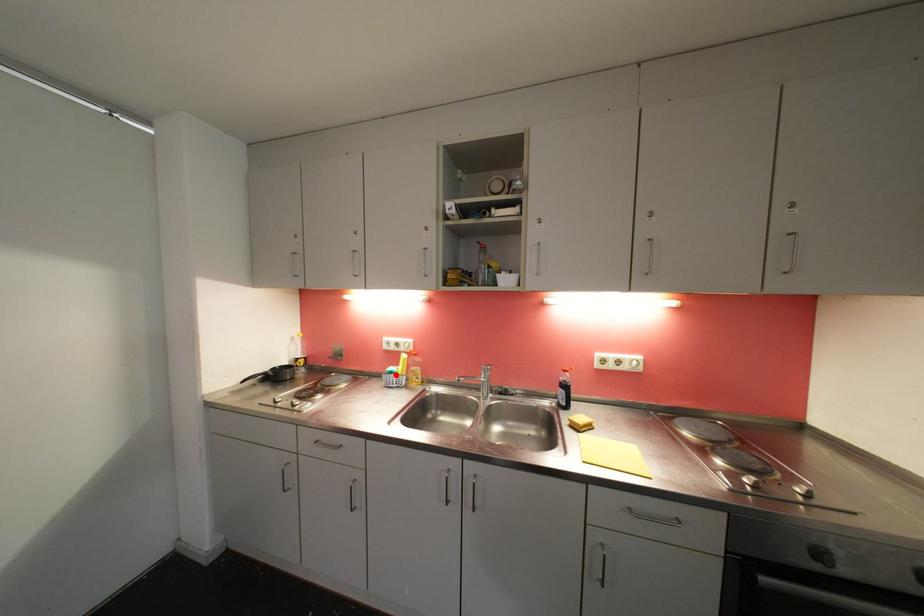
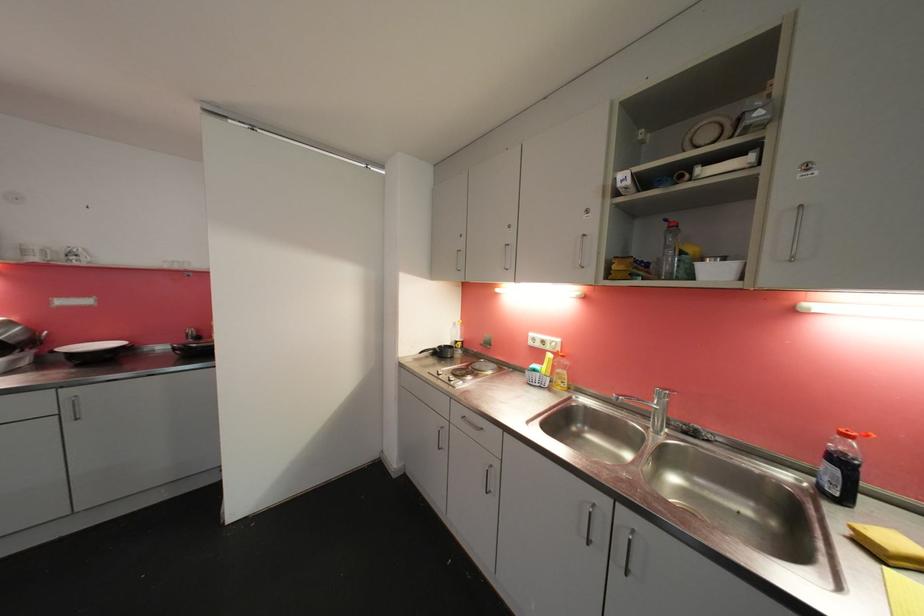
Find the pixel in the second image that matches the highlighted location in the first image.

(540, 373)